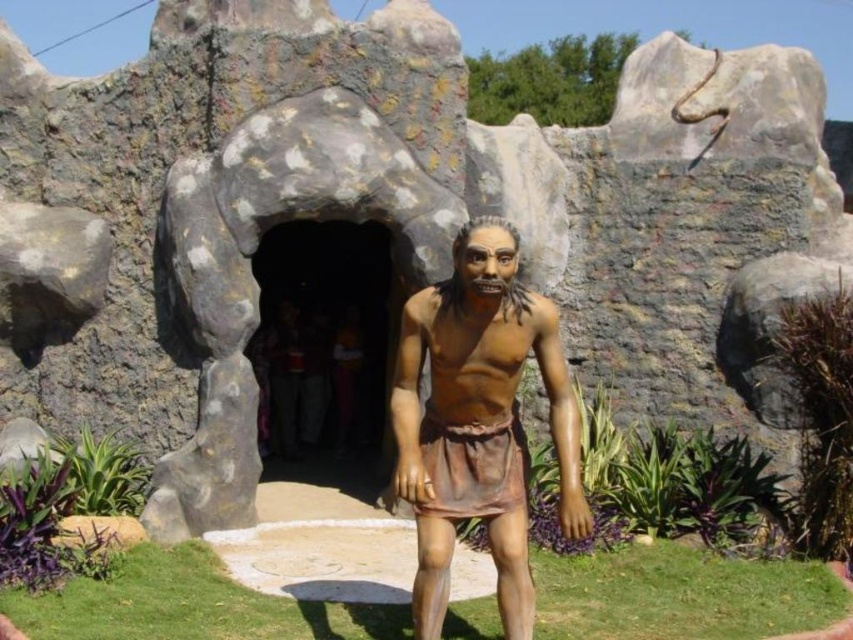
You are an art student analyzing the outdoor sculpture. You notice the brown matte statue at center and the dark stone cave at center. Based on their positions, which object is closer to you?

The brown matte statue at center is closer because it is positioned in front of the dark stone cave at center.